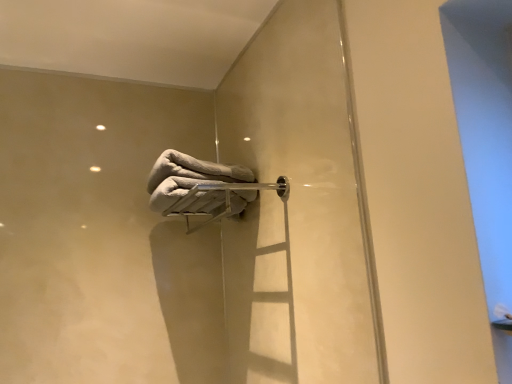
Question: Is gray fluffy towel at center at the back of satin silver towel bar at center?

Choices:
 (A) yes
 (B) no

Answer: (B)

Question: Does satin silver towel bar at center appear on the right side of gray fluffy towel at center?

Choices:
 (A) yes
 (B) no

Answer: (A)

Question: Could you tell me if satin silver towel bar at center is facing gray fluffy towel at center?

Choices:
 (A) no
 (B) yes

Answer: (A)

Question: From the image's perspective, is satin silver towel bar at center beneath gray fluffy towel at center?

Choices:
 (A) no
 (B) yes

Answer: (B)

Question: Can you confirm if satin silver towel bar at center is wider than gray fluffy towel at center?

Choices:
 (A) no
 (B) yes

Answer: (A)

Question: Considering the relative sizes of satin silver towel bar at center and gray fluffy towel at center in the image provided, is satin silver towel bar at center taller than gray fluffy towel at center?

Choices:
 (A) no
 (B) yes

Answer: (A)

Question: Can you confirm if gray fluffy towel at center is thinner than satin silver towel bar at center?

Choices:
 (A) no
 (B) yes

Answer: (A)

Question: From a real-world perspective, is gray fluffy towel at center positioned under satin silver towel bar at center based on gravity?

Choices:
 (A) no
 (B) yes

Answer: (A)

Question: Is gray fluffy towel at center at the left side of satin silver towel bar at center?

Choices:
 (A) no
 (B) yes

Answer: (B)

Question: Considering the relative sizes of gray fluffy towel at center and satin silver towel bar at center in the image provided, is gray fluffy towel at center taller than satin silver towel bar at center?

Choices:
 (A) no
 (B) yes

Answer: (B)

Question: Is gray fluffy towel at center smaller than satin silver towel bar at center?

Choices:
 (A) no
 (B) yes

Answer: (B)

Question: Can you confirm if gray fluffy towel at center is shorter than satin silver towel bar at center?

Choices:
 (A) yes
 (B) no

Answer: (B)

Question: From a real-world perspective, relative to satin silver towel bar at center, is gray fluffy towel at center vertically above or below?

Choices:
 (A) above
 (B) below

Answer: (A)